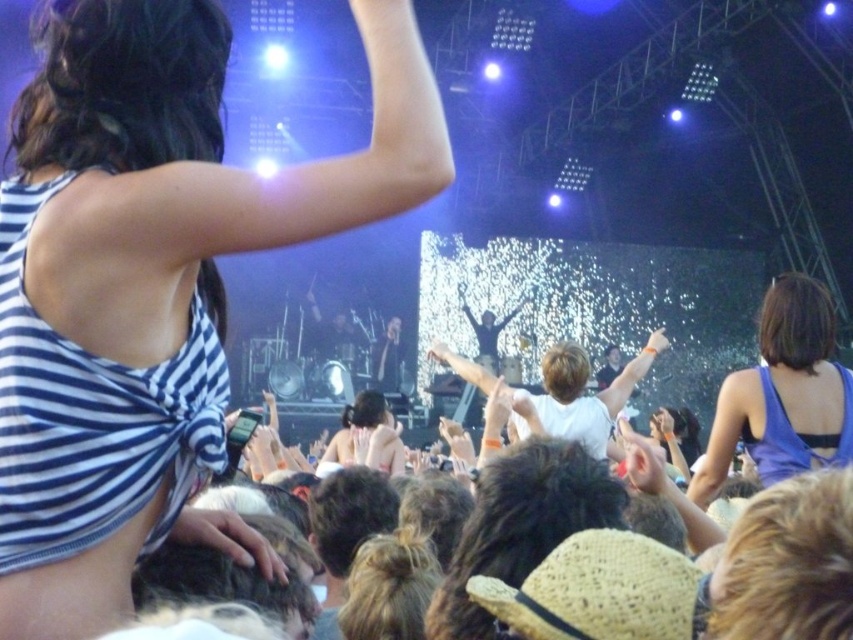
You are a photographer at the concert and want to capture both the striped fabric tank top at upper left and the blue satin dress at upper right in a single shot. Which one will appear larger in the photo?

The striped fabric tank top at upper left will appear larger in the photo because it is closer to the viewer than the blue satin dress at upper right.